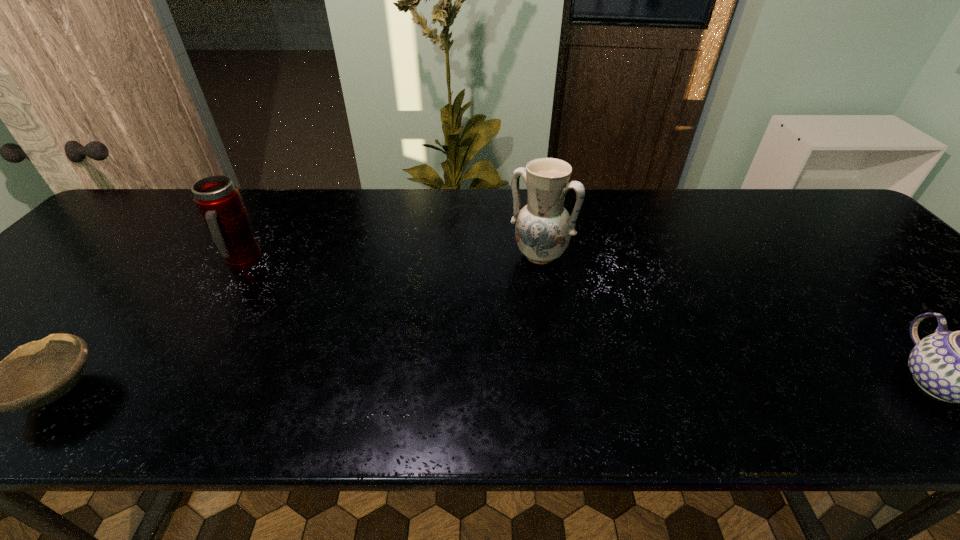
Locate an element on the screen. This screenshot has width=960, height=540. thermos bottle is located at coordinates (219, 202).

Find the location of a particular element. the third shortest object is located at coordinates (219, 202).

You are a GUI agent. You are given a task and a screenshot of the screen. Output one action in this format:
    pyautogui.click(x=<x>, y=<y>)
    Task: Click on the third object from left to right
    This screenshot has width=960, height=540.
    Given the screenshot: What is the action you would take?
    pyautogui.click(x=543, y=230)

Find the location of a particular element. The image size is (960, 540). free space located 0.070m on the side with the handle of the thermos bottle is located at coordinates (264, 287).

Identify the location of vacant space located on the side with the handle of the thermos bottle. This screenshot has height=540, width=960. (266, 289).

At what (x,y) coordinates should I click in order to perform the action: click on free spot located on the side with the handle of the thermos bottle. Please return your answer as a coordinate pair (x, y). The image size is (960, 540). Looking at the image, I should click on (296, 318).

I want to click on vacant region located on either side of the pottery, so click(x=487, y=336).

This screenshot has height=540, width=960. Identify the location of vacant region located on either side of the pottery. (512, 296).

In order to click on vacant space located on either side of the pottery in this screenshot , I will do `click(464, 374)`.

Image resolution: width=960 pixels, height=540 pixels. Find the location of `vacant space at the far edge`. vacant space at the far edge is located at coordinates (655, 233).